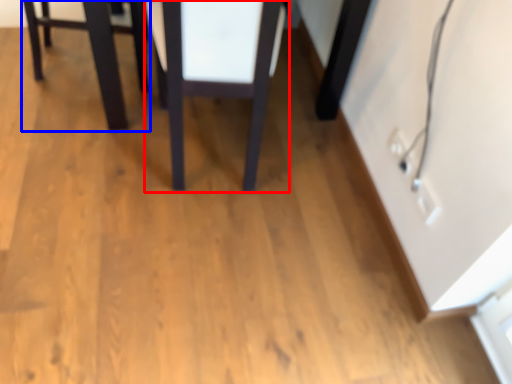
Question: Which object is closer to the camera taking this photo, table (highlighted by a red box) or furniture (highlighted by a blue box)?

Choices:
 (A) table
 (B) furniture

Answer: (A)